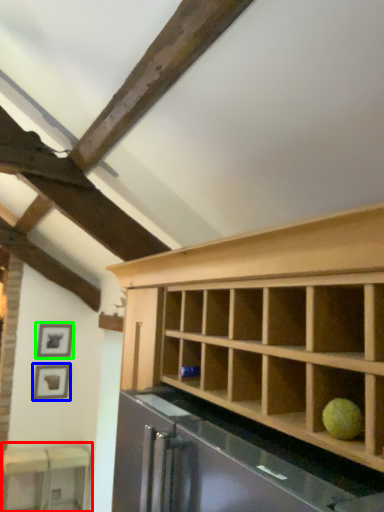
Question: Based on their relative distances, which object is farther from table (highlighted by a red box)? Choose from picture frame (highlighted by a blue box) and picture frame (highlighted by a green box).

Choices:
 (A) picture frame
 (B) picture frame

Answer: (B)